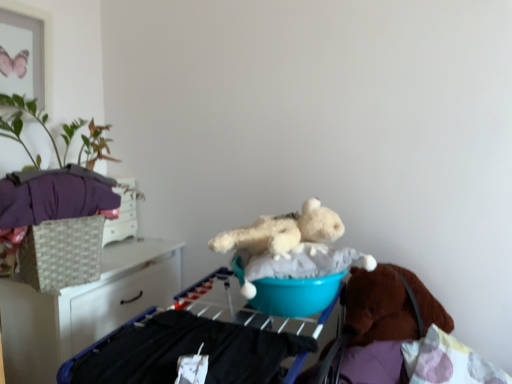
What do you see at coordinates (54, 195) in the screenshot? Image resolution: width=512 pixels, height=384 pixels. I see `purple fleece glove at left` at bounding box center [54, 195].

Measure the distance between point [329,284] and camera.

They are 1.33 meters apart.

You are a GUI agent. You are given a task and a screenshot of the screen. Output one action in this format:
    pyautogui.click(x=<x>, y=<y>)
    Task: Click on the green leafy plant at upper left
    
    Given the screenshot: What is the action you would take?
    pyautogui.click(x=38, y=122)

Describe the element at coordinates (62, 253) in the screenshot. The image size is (512, 384). I see `woven beige basket at left` at that location.

Locate an element on the screen. This screenshot has width=512, height=384. purple fleece glove at left is located at coordinates (54, 195).

Is woven beige basket at left far away from purple fleece glove at left?

woven beige basket at left is near purple fleece glove at left, not far away.

Can you confirm if woven beige basket at left is wider than purple fleece glove at left?

In fact, woven beige basket at left might be narrower than purple fleece glove at left.

From a real-world perspective, is woven beige basket at left physically above purple fleece glove at left?

No, from a real-world perspective, woven beige basket at left is not over purple fleece glove at left

Can you confirm if woven beige basket at left is taller than purple fleece glove at left?

Correct, woven beige basket at left is much taller as purple fleece glove at left.

Which object is further away from the camera, blue plastic basin at center or fluffy white teddy bear at center?

blue plastic basin at center.

Which is nearer, (281, 290) or (338, 216)?

Point (281, 290) is closer to the camera than point (338, 216).

Is blue plastic basin at center outside of fluffy white teddy bear at center?

That's correct, blue plastic basin at center is outside of fluffy white teddy bear at center.

In the scene shown: In the image, is blue plastic basin at center on the left side or the right side of fluffy white teddy bear at center?

In the image, blue plastic basin at center appears on the left side of fluffy white teddy bear at center.

From the image's perspective, is woven beige basket at left located beneath green leafy plant at upper left?

Correct, woven beige basket at left appears lower than green leafy plant at upper left in the image.

What's the angular difference between woven beige basket at left and green leafy plant at upper left's facing directions?

21.5 degrees.

Is green leafy plant at upper left inside woven beige basket at left?

Actually, green leafy plant at upper left is outside woven beige basket at left.

Can you confirm if green leafy plant at upper left is shorter than woven beige basket at left?

Incorrect, the height of green leafy plant at upper left does not fall short of that of woven beige basket at left.

This screenshot has width=512, height=384. What are the coordinates of `basket that is below the green leafy plant at upper left (from the image's perspective)` in the screenshot? It's located at (62, 253).

Is green leafy plant at upper left looking in the opposite direction of woven beige basket at left?

green leafy plant at upper left is not turned away from woven beige basket at left.

Is teal plastic bucket at center turned away from blue plastic basin at center?

No.

Is teal plastic bucket at center shorter than blue plastic basin at center?

No.

Are teal plastic bucket at center and blue plastic basin at center located far from each other?

Actually, teal plastic bucket at center and blue plastic basin at center are a little close together.

Is teal plastic bucket at center completely or partially outside of blue plastic basin at center?

Yes, teal plastic bucket at center is outside of blue plastic basin at center.

Can we say green leafy plant at upper left lies outside blue plastic basin at center?

Indeed, green leafy plant at upper left is completely outside blue plastic basin at center.

Is green leafy plant at upper left taller than blue plastic basin at center?

Yes, green leafy plant at upper left is taller than blue plastic basin at center.

Locate an element on the screen. The width and height of the screenshot is (512, 384). plant behind the blue plastic basin at center is located at coordinates (38, 122).

Is green leafy plant at upper left facing away from blue plastic basin at center?

green leafy plant at upper left is not turned away from blue plastic basin at center.

From the image's perspective, between green leafy plant at upper left and purple fleece glove at left, which one is located above?

green leafy plant at upper left appears higher in the image.

Is point (102, 150) farther from viewer compared to point (57, 178)?

Yes.

Find the location of a particular element. This screenshot has height=384, width=512. plant above the purple fleece glove at left (from the image's perspective) is located at coordinates (38, 122).

Identify the location of basket behind the purple fleece glove at left. (62, 253).

Locate an element on the screen. Image resolution: width=512 pixels, height=384 pixels. teddy bear above the blue plastic basin at center (from the image's perspective) is located at coordinates (291, 246).

Considering their positions, is teal plastic bucket at center positioned closer to fluffy white teddy bear at center than purple fleece glove at left?

teal plastic bucket at center lies closer to fluffy white teddy bear at center than the other object.

Estimate the real-world distances between objects in this image. Which object is closer to white wicker basket at left, purple fleece glove at left or green leafy plant at upper left?

Among the two, purple fleece glove at left is located nearer to white wicker basket at left.

From the picture: Considering their positions, is woven beige basket at left positioned further to fluffy white teddy bear at center than green leafy plant at upper left?

green leafy plant at upper left lies further to fluffy white teddy bear at center than the other object.

Which object lies further to the anchor point blue plastic basin at center, purple fleece glove at left or green leafy plant at upper left?

The object further to blue plastic basin at center is green leafy plant at upper left.

Estimate the real-world distances between objects in this image. Which object is further from woven beige basket at left, green leafy plant at upper left or white wicker basket at left?

green leafy plant at upper left.

Looking at the image, which one is located further to woven beige basket at left, white wicker basket at left or blue plastic basin at center?

blue plastic basin at center is further to woven beige basket at left.

Based on their spatial positions, is blue plastic basin at center or green leafy plant at upper left further from white wicker basket at left?

blue plastic basin at center is positioned further to the anchor white wicker basket at left.

From the image, which object appears to be nearer to purple fleece glove at left, woven beige basket at left or blue plastic basin at center?

woven beige basket at left lies closer to purple fleece glove at left than the other object.

This screenshot has width=512, height=384. I want to click on clothing that lies between green leafy plant at upper left and woven beige basket at left from top to bottom, so click(x=54, y=195).

Where is `bunk bed situated between purple fleece glove at left and blue plastic basin at center from left to right`? bunk bed situated between purple fleece glove at left and blue plastic basin at center from left to right is located at coordinates (179, 352).

Find the location of a particular element. basket between green leafy plant at upper left and fluffy white teddy bear at center in the horizontal direction is located at coordinates (62, 253).

The width and height of the screenshot is (512, 384). What are the coordinates of `clothing between white wicker basket at left and teal plastic bucket at center` in the screenshot? It's located at coord(54,195).